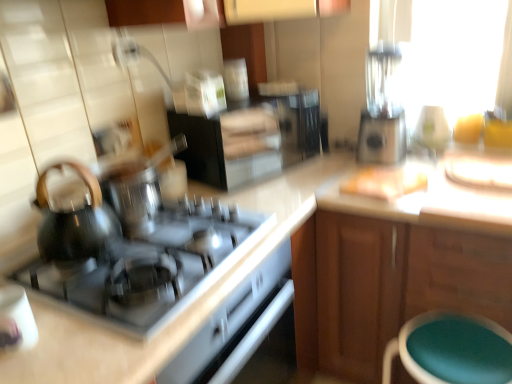
Question: Should I look upward or downward to see sleek silver blender at upper right?

Choices:
 (A) up
 (B) down

Answer: (A)

Question: Would you say shiny black cooktop at center-left is a long distance from teal fabric stool at lower right?

Choices:
 (A) no
 (B) yes

Answer: (A)

Question: Considering the relative sizes of shiny black cooktop at center-left and teal fabric stool at lower right in the image provided, is shiny black cooktop at center-left shorter than teal fabric stool at lower right?

Choices:
 (A) no
 (B) yes

Answer: (B)

Question: Is shiny black cooktop at center-left positioned in front of teal fabric stool at lower right?

Choices:
 (A) no
 (B) yes

Answer: (B)

Question: Considering the relative sizes of shiny black cooktop at center-left and teal fabric stool at lower right in the image provided, is shiny black cooktop at center-left smaller than teal fabric stool at lower right?

Choices:
 (A) yes
 (B) no

Answer: (A)

Question: From a real-world perspective, is shiny black cooktop at center-left positioned under teal fabric stool at lower right based on gravity?

Choices:
 (A) yes
 (B) no

Answer: (B)

Question: Is shiny black cooktop at center-left aimed at teal fabric stool at lower right?

Choices:
 (A) no
 (B) yes

Answer: (A)

Question: Is shiny black cooktop at center-left at the back of shiny black kettle at left?

Choices:
 (A) yes
 (B) no

Answer: (B)

Question: Does shiny black kettle at left have a lesser height compared to shiny black cooktop at center-left?

Choices:
 (A) yes
 (B) no

Answer: (B)

Question: From the image's perspective, would you say shiny black kettle at left is positioned over shiny black cooktop at center-left?

Choices:
 (A) yes
 (B) no

Answer: (A)

Question: Is shiny black kettle at left thinner than shiny black cooktop at center-left?

Choices:
 (A) yes
 (B) no

Answer: (A)

Question: Is shiny black kettle at left surrounding shiny black cooktop at center-left?

Choices:
 (A) yes
 (B) no

Answer: (B)

Question: Is shiny black kettle at left to the right of shiny black cooktop at center-left from the viewer's perspective?

Choices:
 (A) yes
 (B) no

Answer: (B)

Question: Can you confirm if wooden cabinet at right is wider than sleek silver blender at upper right?

Choices:
 (A) yes
 (B) no

Answer: (A)